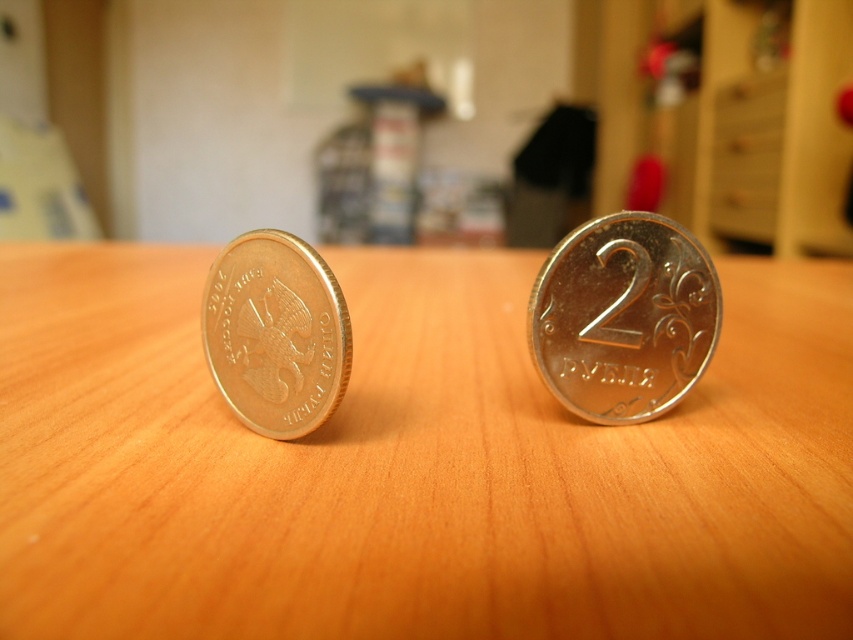
Question: Is wooden table at center to the right of gold metallic coin at left from the viewer's perspective?

Choices:
 (A) yes
 (B) no

Answer: (A)

Question: Among these objects, which one is farthest from the camera?

Choices:
 (A) gold metallic coin at left
 (B) silver/metallic coin at center
 (C) wooden table at center

Answer: (B)

Question: Which of the following is the closest to the observer?

Choices:
 (A) silver/metallic coin at center
 (B) wooden table at center
 (C) gold metallic coin at left

Answer: (B)

Question: Which of the following is the closest to the observer?

Choices:
 (A) (688, 291)
 (B) (250, 244)

Answer: (B)

Question: Can you confirm if silver/metallic coin at center is positioned to the left of gold metallic coin at left?

Choices:
 (A) yes
 (B) no

Answer: (B)

Question: Does silver/metallic coin at center appear on the right side of gold metallic coin at left?

Choices:
 (A) yes
 (B) no

Answer: (A)